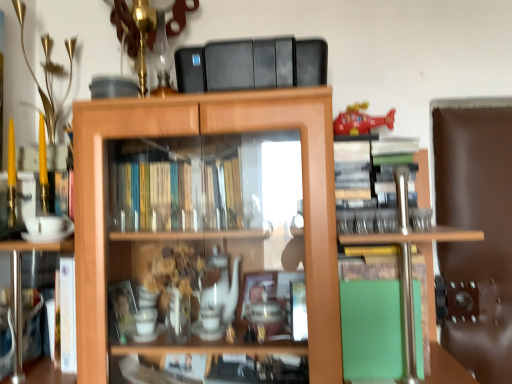
Question: Is green matte book at lower left, marked as the 2th book in a right-to-left arrangement, taller than shiny plastic helicopter at upper right?

Choices:
 (A) yes
 (B) no

Answer: (A)

Question: Considering the relative sizes of green matte book at lower left, marked as the 2th book in a right-to-left arrangement, and shiny plastic helicopter at upper right in the image provided, is green matte book at lower left, marked as the 2th book in a right-to-left arrangement, wider than shiny plastic helicopter at upper right?

Choices:
 (A) no
 (B) yes

Answer: (B)

Question: Is green matte book at lower left, placed as the first book when sorted from left to right, facing towards shiny plastic helicopter at upper right?

Choices:
 (A) no
 (B) yes

Answer: (A)

Question: Is green matte book at lower left, placed as the first book when sorted from left to right, further to the viewer compared to shiny plastic helicopter at upper right?

Choices:
 (A) no
 (B) yes

Answer: (A)

Question: From a real-world perspective, does green matte book at lower left, marked as the 2th book in a right-to-left arrangement, stand above shiny plastic helicopter at upper right?

Choices:
 (A) no
 (B) yes

Answer: (A)

Question: Is green matte book at lower left, placed as the first book when sorted from left to right, in front of or behind shiny plastic helicopter at upper right in the image?

Choices:
 (A) front
 (B) behind

Answer: (A)

Question: Looking at the image, does green matte book at lower left, placed as the first book when sorted from left to right, seem bigger or smaller compared to shiny plastic helicopter at upper right?

Choices:
 (A) big
 (B) small

Answer: (A)

Question: Is green matte book at lower left, marked as the 2th book in a right-to-left arrangement, spatially inside shiny plastic helicopter at upper right, or outside of it?

Choices:
 (A) outside
 (B) inside

Answer: (A)

Question: From a real-world perspective, is green matte book at lower left, marked as the 2th book in a right-to-left arrangement, physically located above or below shiny plastic helicopter at upper right?

Choices:
 (A) above
 (B) below

Answer: (B)

Question: Looking at their shapes, would you say wooden cabinet at center is wider or thinner than shiny plastic helicopter at upper right?

Choices:
 (A) thin
 (B) wide

Answer: (B)

Question: In the image, is wooden cabinet at center on the left side or the right side of shiny plastic helicopter at upper right?

Choices:
 (A) left
 (B) right

Answer: (A)

Question: In the image, is wooden cabinet at center positioned in front of or behind shiny plastic helicopter at upper right?

Choices:
 (A) front
 (B) behind

Answer: (A)

Question: Considering the positions of wooden cabinet at center and shiny plastic helicopter at upper right in the image, is wooden cabinet at center bigger or smaller than shiny plastic helicopter at upper right?

Choices:
 (A) small
 (B) big

Answer: (B)

Question: In the image, is green matte book at lower left, marked as the 2th book in a right-to-left arrangement, on the left side or the right side of wooden cabinet at center?

Choices:
 (A) left
 (B) right

Answer: (A)

Question: Do you think green matte book at lower left, placed as the first book when sorted from left to right, is within wooden cabinet at center, or outside of it?

Choices:
 (A) outside
 (B) inside

Answer: (B)